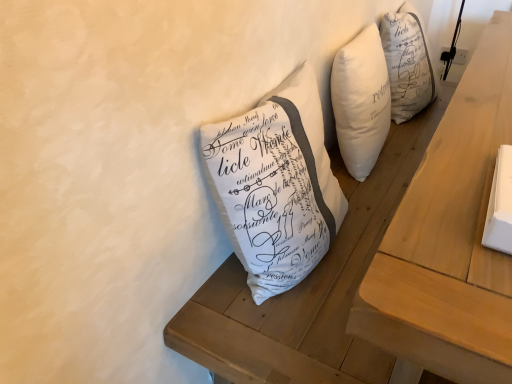
Image resolution: width=512 pixels, height=384 pixels. What do you see at coordinates (358, 247) in the screenshot?
I see `white fabric pillow at center` at bounding box center [358, 247].

Where is `white fabric pillow at center`? Image resolution: width=512 pixels, height=384 pixels. white fabric pillow at center is located at coordinates (358, 247).

Identify the location of wooden table at center. The image size is (512, 384). (449, 241).

What do you see at coordinates (449, 241) in the screenshot? I see `wooden table at center` at bounding box center [449, 241].

The image size is (512, 384). I want to click on white fabric pillow at center, so click(x=358, y=247).

Is wooden table at center at the left side of white fabric pillow at center?

No, wooden table at center is not to the left of white fabric pillow at center.

Considering the relative positions of wooden table at center and white fabric pillow at center in the image provided, is wooden table at center in front of white fabric pillow at center?

Yes, it is.

Is point (390, 279) closer to viewer compared to point (346, 234)?

Yes, point (390, 279) is in front of point (346, 234).

From the image's perspective, between wooden table at center and white fabric pillow at center, which one is located above?

From the image's view, wooden table at center is above.

In the scene shown: From a real-world perspective, is wooden table at center physically below white fabric pillow at center?

Indeed, from a real-world perspective, wooden table at center is positioned beneath white fabric pillow at center.

Considering the relative sizes of wooden table at center and white fabric pillow at center in the image provided, is wooden table at center thinner than white fabric pillow at center?

Yes, wooden table at center is thinner than white fabric pillow at center.

Can you confirm if wooden table at center is shorter than white fabric pillow at center?

Yes.

Between wooden table at center and white fabric pillow at center, which one has smaller size?

white fabric pillow at center is smaller.

Which is correct: wooden table at center is inside white fabric pillow at center, or outside of it?

wooden table at center is not enclosed by white fabric pillow at center.

From the picture: Are wooden table at center and white fabric pillow at center located far from each other?

No.

Is wooden table at center oriented towards white fabric pillow at center?

Yes, wooden table at center is facing white fabric pillow at center.

Looking at this image, how different are the orientations of wooden table at center and white fabric pillow at center in degrees?

wooden table at center and white fabric pillow at center are facing 1.62 degrees away from each other.

You are a GUI agent. You are given a task and a screenshot of the screen. Output one action in this format:
    pyautogui.click(x=<x>, y=<y>)
    Task: Click on the table lying on the right of white fabric pillow at center
    The image size is (512, 384).
    Given the screenshot: What is the action you would take?
    pyautogui.click(x=449, y=241)

From the picture: Is white fabric pillow at center to the right of wooden table at center from the viewer's perspective?

In fact, white fabric pillow at center is to the left of wooden table at center.

In the image, is white fabric pillow at center positioned in front of or behind wooden table at center?

white fabric pillow at center is positioned farther from the viewer than wooden table at center.

Which is in front, point (482, 131) or point (510, 268)?

The point (510, 268) is closer to the camera.

From the image's perspective, between white fabric pillow at center and wooden table at center, who is located below?

white fabric pillow at center.

From a real-world perspective, which object rests below the other?

wooden table at center.

Consider the image. Can you confirm if white fabric pillow at center is thinner than wooden table at center?

No.

Which of these two, white fabric pillow at center or wooden table at center, stands taller?

white fabric pillow at center is taller.

Looking at the image, does white fabric pillow at center seem bigger or smaller compared to wooden table at center?

Considering their sizes, white fabric pillow at center takes up less space than wooden table at center.

Is white fabric pillow at center situated inside wooden table at center or outside?

white fabric pillow at center is contained in wooden table at center.

Are white fabric pillow at center and wooden table at center far apart?

white fabric pillow at center is actually quite close to wooden table at center.

Is white fabric pillow at center positioned with its back to wooden table at center?

white fabric pillow at center is not turned away from wooden table at center.

Can you tell me how much white fabric pillow at center and wooden table at center differ in facing direction?

They differ by 1.62 degrees in their facing directions.

You are a GUI agent. You are given a task and a screenshot of the screen. Output one action in this format:
    pyautogui.click(x=<x>, y=<y>)
    Task: Click on the table on the right of the white fabric pillow at center
    
    Given the screenshot: What is the action you would take?
    pyautogui.click(x=449, y=241)

Locate an element on the screen. table above the white fabric pillow at center (from the image's perspective) is located at coordinates (449, 241).

Image resolution: width=512 pixels, height=384 pixels. What are the coordinates of `furniture to the left of wooden table at center` in the screenshot? It's located at (358, 247).